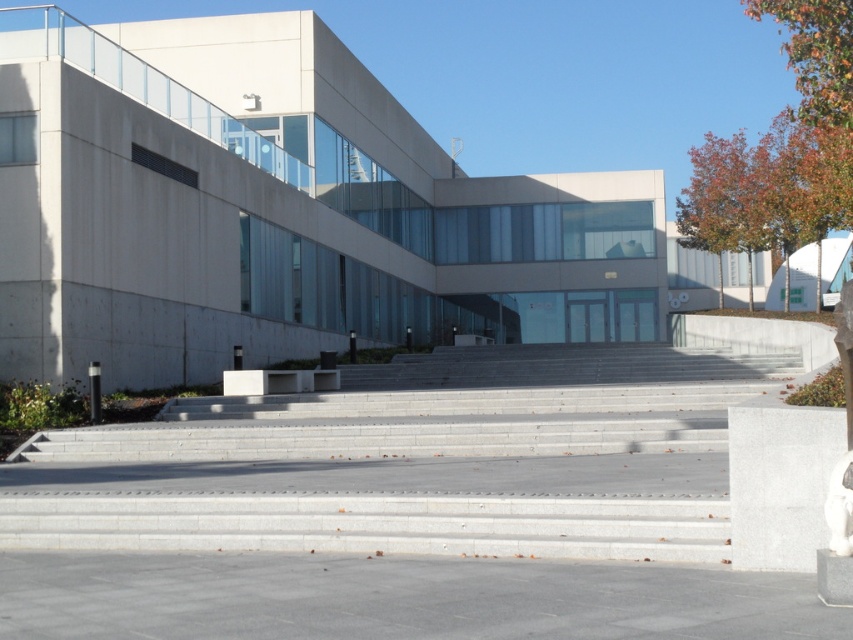
You are standing at the base of the gray concrete stairs at center and want to look up towards the orange leafy tree at upper right. In which direction should you turn your head?

You should look upwards because the gray concrete stairs at center is below the orange leafy tree at upper right.